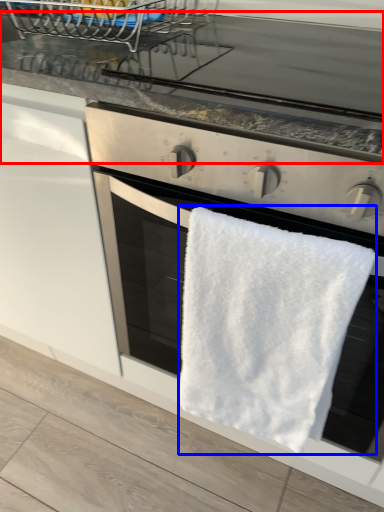
Question: Which of the following is the closest to the observer, countertop (highlighted by a red box) or towel/napkin (highlighted by a blue box)?

Choices:
 (A) countertop
 (B) towel/napkin

Answer: (B)